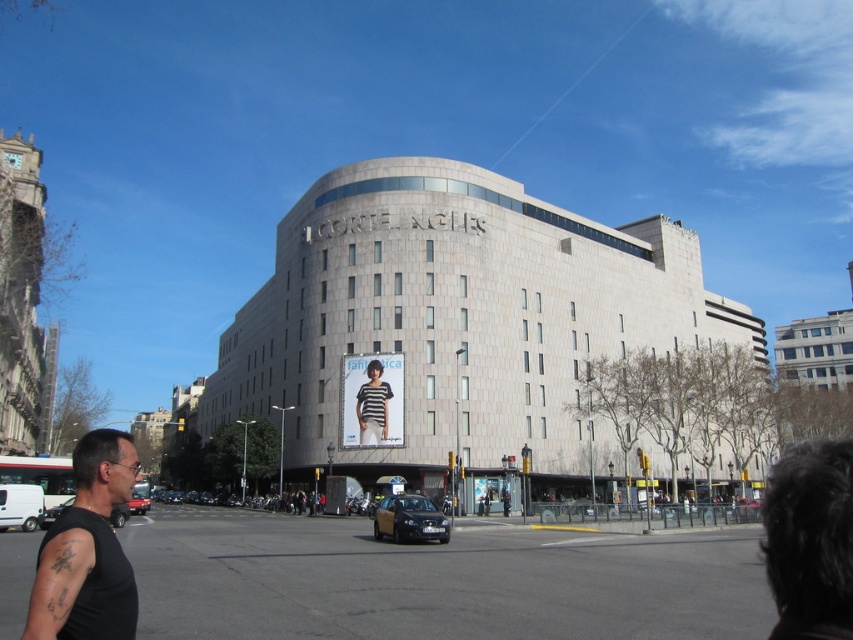
The image size is (853, 640). Describe the element at coordinates (86, 550) in the screenshot. I see `black matte tank top at lower left` at that location.

From the picture: Can you confirm if black matte tank top at lower left is thinner than striped fabric shirt at center?

No, black matte tank top at lower left is not thinner than striped fabric shirt at center.

Is point (80, 516) behind point (357, 410)?

No, (80, 516) is closer to viewer.

Find the location of `black matte tank top at lower left`. black matte tank top at lower left is located at coordinates (86, 550).